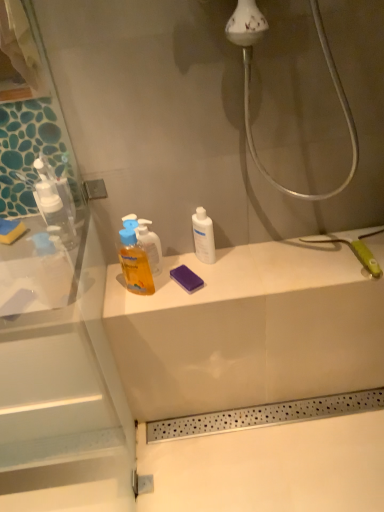
The image size is (384, 512). Find the location of `free space between translucent plastic bottle at center and white matte bottle at center`. free space between translucent plastic bottle at center and white matte bottle at center is located at coordinates [x=176, y=275].